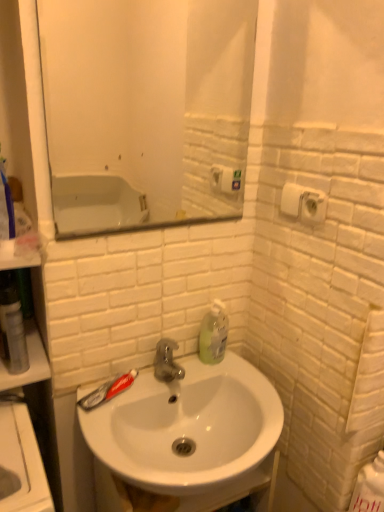
Question: Are translucent plastic soap dispenser at upper right and white glossy sink at center located far from each other?

Choices:
 (A) yes
 (B) no

Answer: (B)

Question: Can you confirm if translucent plastic soap dispenser at upper right is positioned to the left of white glossy sink at center?

Choices:
 (A) no
 (B) yes

Answer: (A)

Question: Is translucent plastic soap dispenser at upper right positioned with its back to white glossy sink at center?

Choices:
 (A) yes
 (B) no

Answer: (B)

Question: Does translucent plastic soap dispenser at upper right turn towards white glossy sink at center?

Choices:
 (A) yes
 (B) no

Answer: (B)

Question: Is translucent plastic soap dispenser at upper right smaller than white glossy sink at center?

Choices:
 (A) yes
 (B) no

Answer: (A)

Question: Looking at the image, does white matte toilet paper at upper right seem bigger or smaller compared to transparent plastic mouthwash at left?

Choices:
 (A) big
 (B) small

Answer: (B)

Question: In the image, is white matte toilet paper at upper right on the left side or the right side of transparent plastic mouthwash at left?

Choices:
 (A) right
 (B) left

Answer: (A)

Question: Which is correct: white matte toilet paper at upper right is inside transparent plastic mouthwash at left, or outside of it?

Choices:
 (A) inside
 (B) outside

Answer: (B)

Question: From a real-world perspective, is white matte toilet paper at upper right above or below transparent plastic mouthwash at left?

Choices:
 (A) above
 (B) below

Answer: (A)

Question: Looking at the image, does transparent plastic mouthwash at left seem bigger or smaller compared to translucent plastic toothpaste at sink left?

Choices:
 (A) small
 (B) big

Answer: (B)

Question: Considering their positions, is transparent plastic mouthwash at left located in front of or behind translucent plastic toothpaste at sink left?

Choices:
 (A) front
 (B) behind

Answer: (A)

Question: Is point (16, 317) positioned closer to the camera than point (127, 372)?

Choices:
 (A) closer
 (B) farther

Answer: (A)

Question: Is transparent plastic mouthwash at left to the left or to the right of translucent plastic toothpaste at sink left in the image?

Choices:
 (A) right
 (B) left

Answer: (B)

Question: Is point (152, 378) positioned closer to the camera than point (306, 203)?

Choices:
 (A) closer
 (B) farther

Answer: (B)

Question: Considering the positions of white glossy sink at center and white matte toilet paper at upper right in the image, is white glossy sink at center bigger or smaller than white matte toilet paper at upper right?

Choices:
 (A) big
 (B) small

Answer: (A)